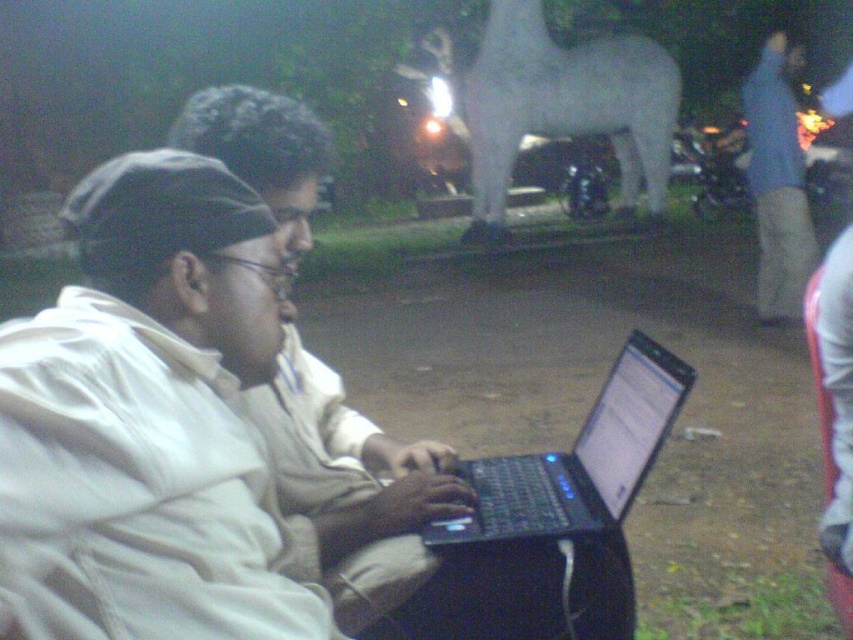
Question: Does white matte jacket at center have a smaller size compared to white matte laptop at center?

Choices:
 (A) yes
 (B) no

Answer: (A)

Question: Among these points, which one is farthest from the camera?

Choices:
 (A) tap(271, 608)
 (B) tap(805, 269)
 (C) tap(328, 477)
 (D) tap(602, 408)

Answer: (B)

Question: Is white matte jacket at center behind black plastic laptop at center?

Choices:
 (A) yes
 (B) no

Answer: (B)

Question: Which point is farther to the camera?

Choices:
 (A) (589, 451)
 (B) (157, 564)
 (C) (776, 58)
 (D) (337, 456)

Answer: (C)

Question: Which object is positioned farthest from the white matte laptop at center?

Choices:
 (A) white matte jacket at center
 (B) blue jeans at right
 (C) black plastic laptop at center

Answer: (B)

Question: Is white matte jacket at center below black plastic laptop at center?

Choices:
 (A) no
 (B) yes

Answer: (A)